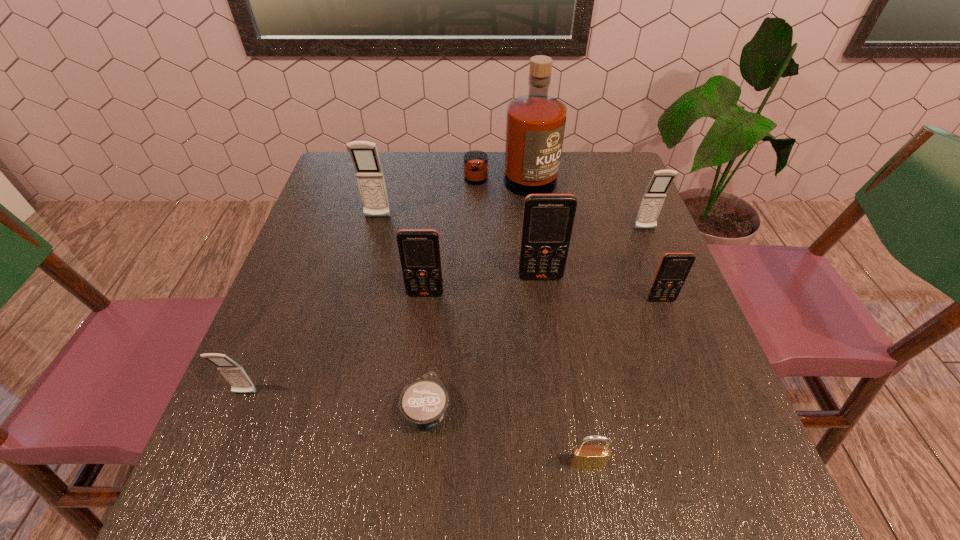
You are a GUI agent. You are given a task and a screenshot of the screen. Output one action in this format:
    pyautogui.click(x=<x>, y=<y>)
    Task: Click on the vacant space at the right edge of the desktop
    This screenshot has width=960, height=540.
    Given the screenshot: What is the action you would take?
    pyautogui.click(x=653, y=318)

The height and width of the screenshot is (540, 960). I want to click on free space at the far left corner of the desktop, so click(x=333, y=191).

Identify the location of vacant space at the near left corner of the desktop. (304, 472).

Where is `vacant space at the far right corner`? vacant space at the far right corner is located at coordinates (625, 195).

Identify the location of empty space that is in between the second biggest orange cellular telephone and the yogurt. (426, 352).

You are a GUI agent. You are given a task and a screenshot of the screen. Output one action in this format:
    pyautogui.click(x=<x>, y=<y>)
    Task: Click on the unoccupied position between the yogurt and the second biggest gray cellular telephone
    
    Given the screenshot: What is the action you would take?
    pyautogui.click(x=536, y=320)

Locate an element on the screen. This screenshot has height=540, width=960. free point between the farthest object and the shortest object is located at coordinates (468, 296).

What are the coordinates of `vacant point located between the fifth nearest cellular telephone and the second orange cellular telephone from right to left` in the screenshot? It's located at (592, 253).

Where is `vacant space that's between the fourth cellular telephone from right to left and the tallest object`? The height and width of the screenshot is (540, 960). vacant space that's between the fourth cellular telephone from right to left and the tallest object is located at coordinates pyautogui.click(x=468, y=238).

Locate an element on the screen. blank region between the leftmost cellular telephone and the tallest object is located at coordinates (377, 288).